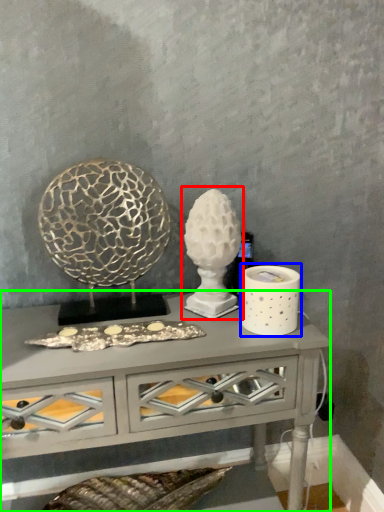
Question: Estimate the real-world distances between objects in this image. Which object is farther from sculpture (highlighted by a red box), candle holder (highlighted by a blue box) or table (highlighted by a green box)?

Choices:
 (A) candle holder
 (B) table

Answer: (B)